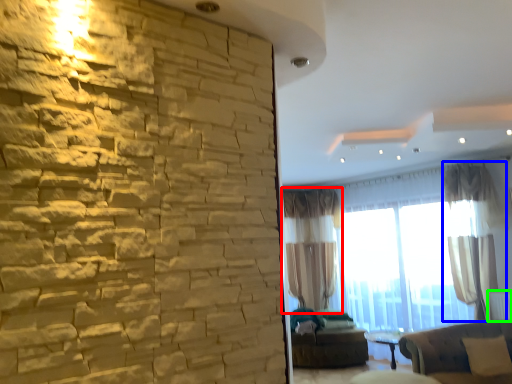
Question: Based on their relative distances, which object is nearer to curtain (highlighted by a red box)? Choose from curtain (highlighted by a blue box) and radiator (highlighted by a green box).

Choices:
 (A) curtain
 (B) radiator

Answer: (A)